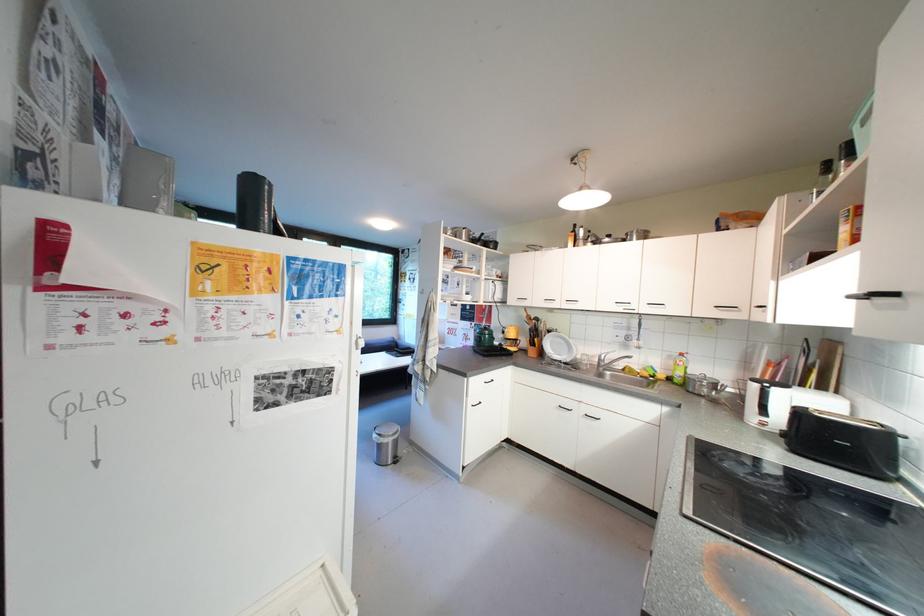
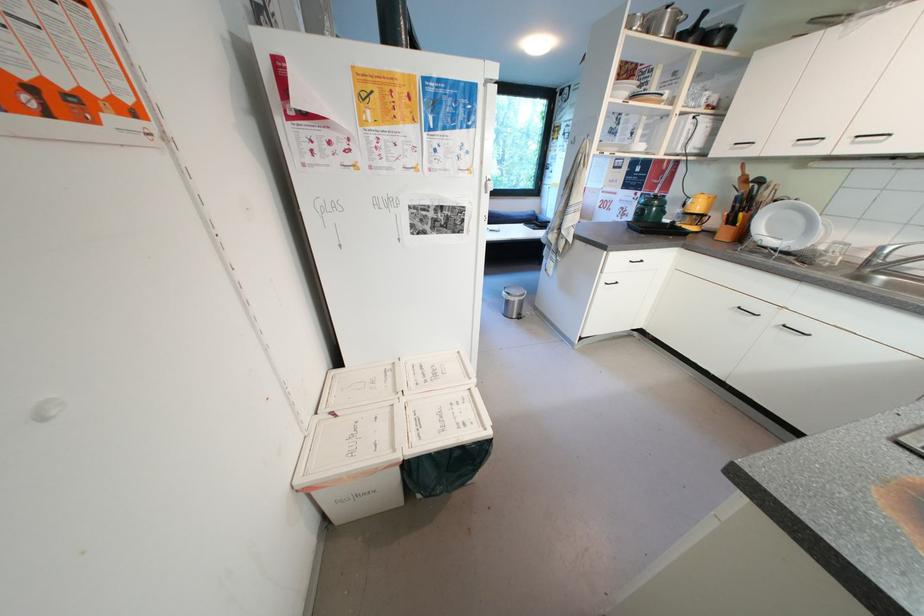
In the second image, find the point that corresponds to (x=383, y=438) in the first image.

(512, 294)